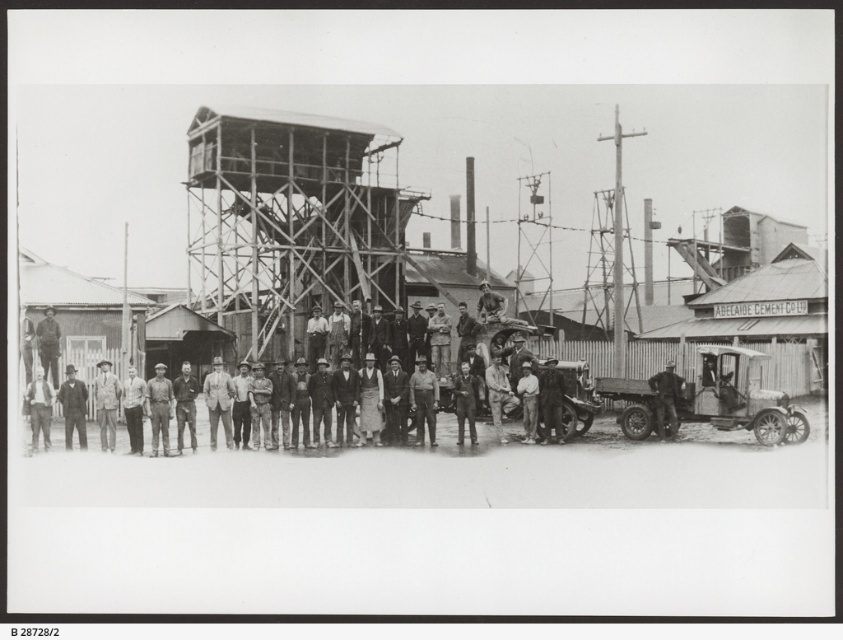
You are an architect examining this historical photograph. You notice the metallic scaffolding at center and the dark gray fabric shirt at center. Which object in the image is bigger?

The metallic scaffolding at center is larger in size than the dark gray fabric shirt at center.

You are a photographer adjusting your camera settings to capture the group in the image. You notice two individuals wearing a light brown leather jacket at center and a dark gray uniform at center. Which clothing item is positioned higher in the frame?

The light brown leather jacket at center is taller than the dark gray uniform at center, so the light brown leather jacket at center is positioned higher in the frame.

Looking at this image, you are a photographer adjusting your camera to focus on the dark gray uniform at center and the dark gray fabric shirt at center in the group photo. Which of these two items is positioned closer to the camera?

The dark gray uniform at center is closer to the viewer than the dark gray fabric shirt at center, so the dark gray uniform at center is the one closer to the camera.